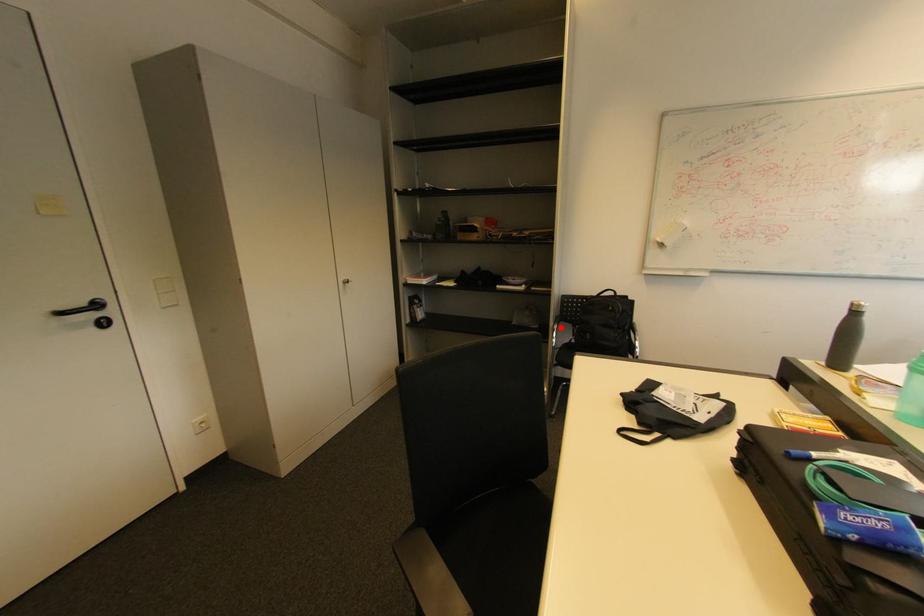
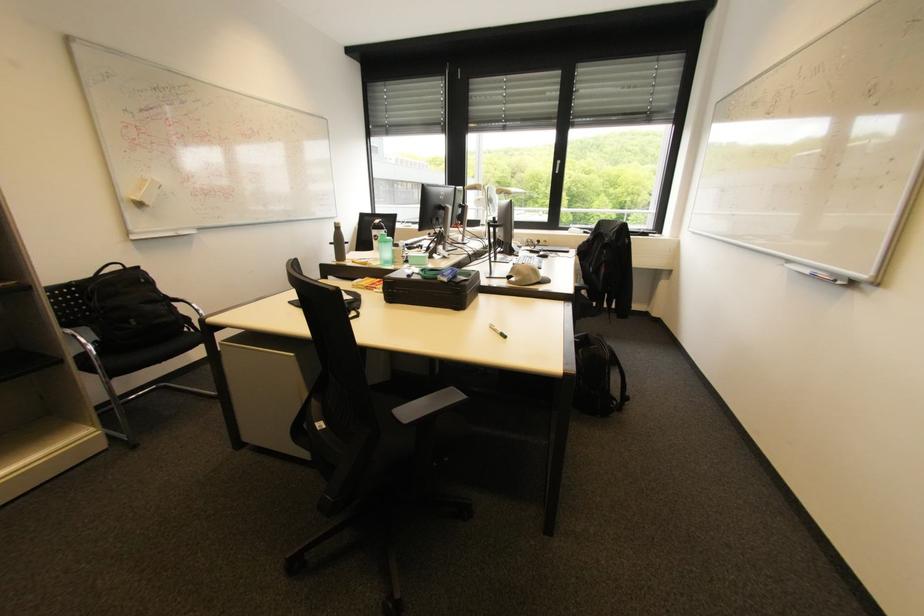
Question: I am providing you with two images of the same scene from different viewpoints. Image1 has a red point marked. In image2, the corresponding 3D location appears at what relative position? Reply with the corresponding letter.

Choices:
 (A) Closer
 (B) Farther

Answer: (B)